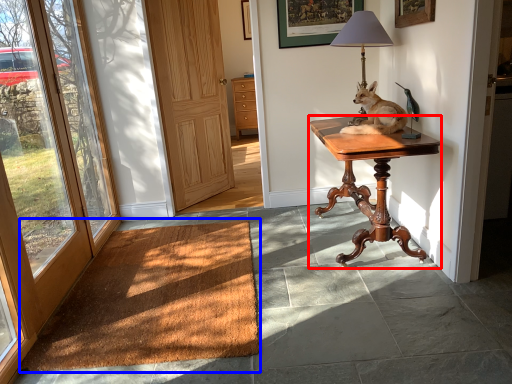
Question: Which point is closer to the camera, desk (highlighted by a red box) or doormat (highlighted by a blue box)?

Choices:
 (A) desk
 (B) doormat

Answer: (B)